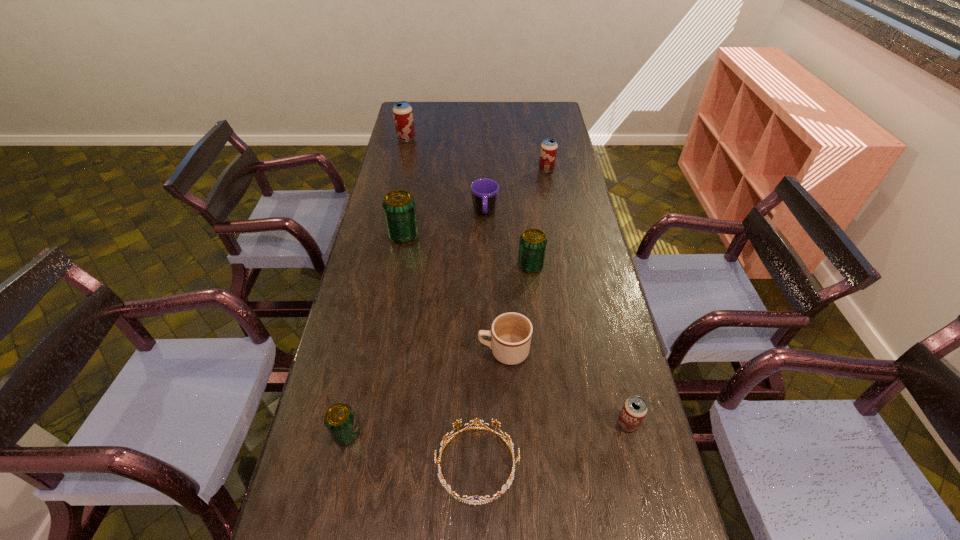
What are the coordinates of `vacant position in the image that satisfies the following two spatial constraints: 1. with the handle on the side of the third farthest object; 2. on the side of the nearer mug with the handle` in the screenshot? It's located at (487, 352).

Where is `free point that satisfies the following two spatial constraints: 1. on the side of the fourth nearest object with the handle; 2. with the handle on the side of the seventh nearest object`? This screenshot has width=960, height=540. free point that satisfies the following two spatial constraints: 1. on the side of the fourth nearest object with the handle; 2. with the handle on the side of the seventh nearest object is located at coordinates [x=497, y=213].